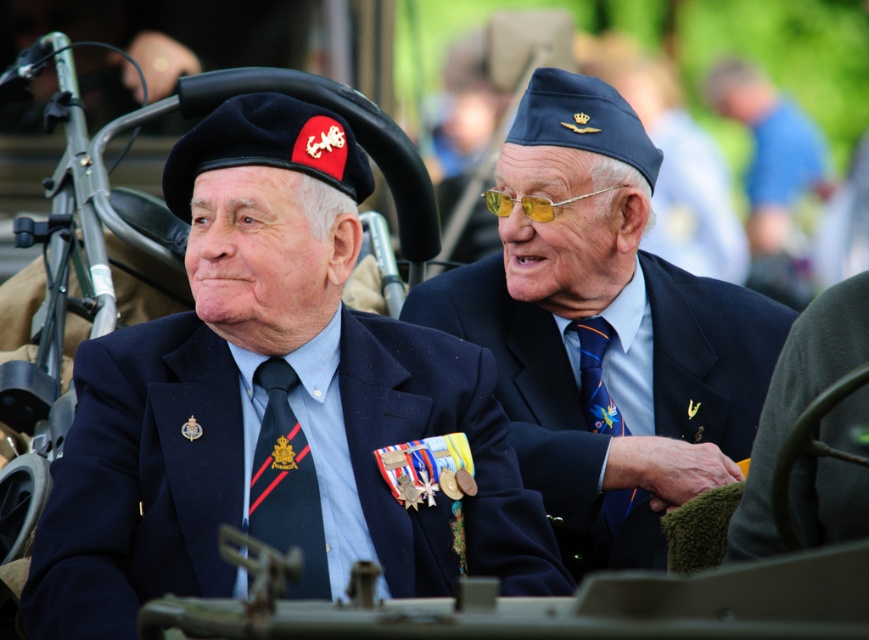
You are standing at the camera position and want to throw a ball to the point marked as point [775,205]. Can you estimate if the ball will reach that point if you throw it with an average strength?

The distance between you and point [775,205] is 48.67 meters. An average throw can typically reach up to around 30 meters, so the ball will not reach the point.

Looking at this image, you are a photographer at a military event. You need to place a small pin exactly at the center of the black silk tie. The coordinate system has the origin at the bottom left corner of the image. The point provided is at coordinate point (x=286, y=484). Is this point on the black silk tie at center?

Yes, the point (x=286, y=484) is on the black silk tie at center.